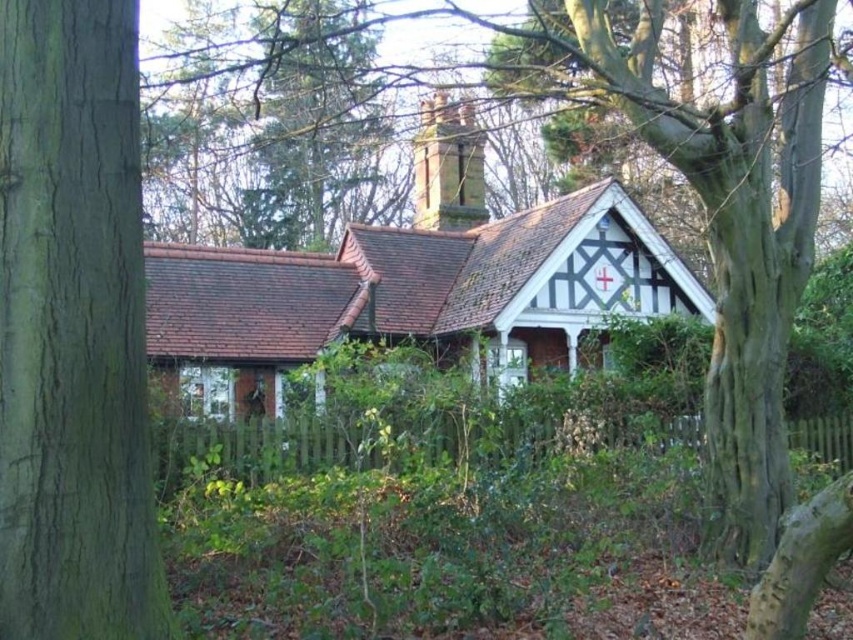
You are standing at the point closest to the camera in the image. Which of the two points, point (148, 476) or point (173, 372), are you currently at?

You are at point (148, 476) because it is in front of point (173, 372), so it is closer to the camera.

You are standing in front of the white painted wood cottage at center and want to walk to the green rough bark tree at left. Which direction should you face to move towards it?

You should face to the left to move towards the green rough bark tree at left since it is located to the left of the white painted wood cottage at center.